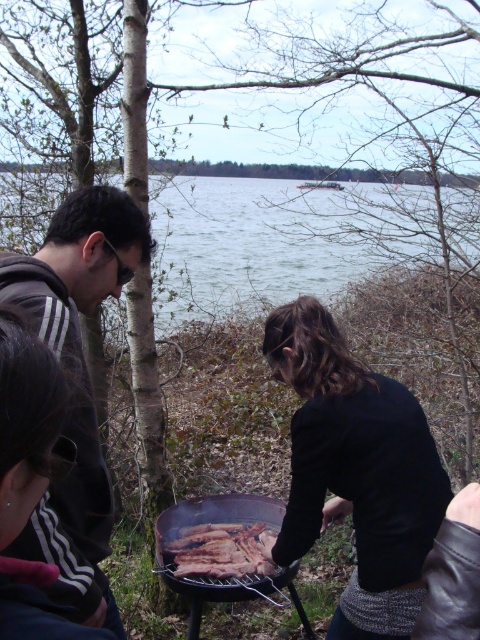
You are planning to set up a small tent in this lakeside area. The tent requires a flat area that is higher than the dark gray sweater at center but lower than the green water at center. Is there a suitable spot available based on the height differences mentioned?

The dark gray sweater at center has a lesser height compared to green water at center. Since the tent needs an area higher than the sweater but lower than the water, there might be a suitable spot between their heights. However, without exact measurements, it is uncertain if such a spot exists in the scene.

You are planning to set up a small tent in this lakeside area. Considering the dark gray hoodie at left and the green water at center, which object would be a better reference point for the tent location to avoid flooding during rain?

The dark gray hoodie at left is shorter than the green water at center. To avoid flooding, place the tent at a higher elevation than the dark gray hoodie at left since the water level might rise to the height of the green water at center during rain.

You are planning to set up a small table between the dark gray hoodie at left and the green water at center. Considering their sizes, will the table fit comfortably between them?

The dark gray hoodie at left is narrower than the green water at center, so a small table should fit comfortably between them as there is enough space.